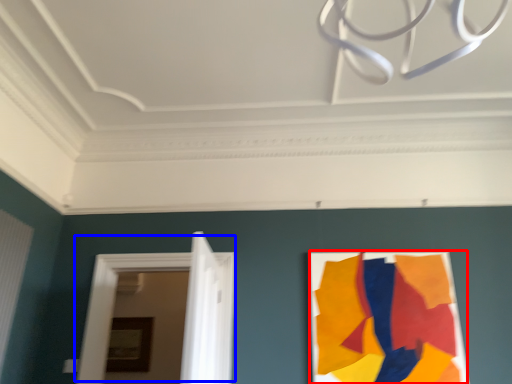
Question: Which object appears closest to the camera in this image, poster (highlighted by a red box) or door (highlighted by a blue box)?

Choices:
 (A) poster
 (B) door

Answer: (A)